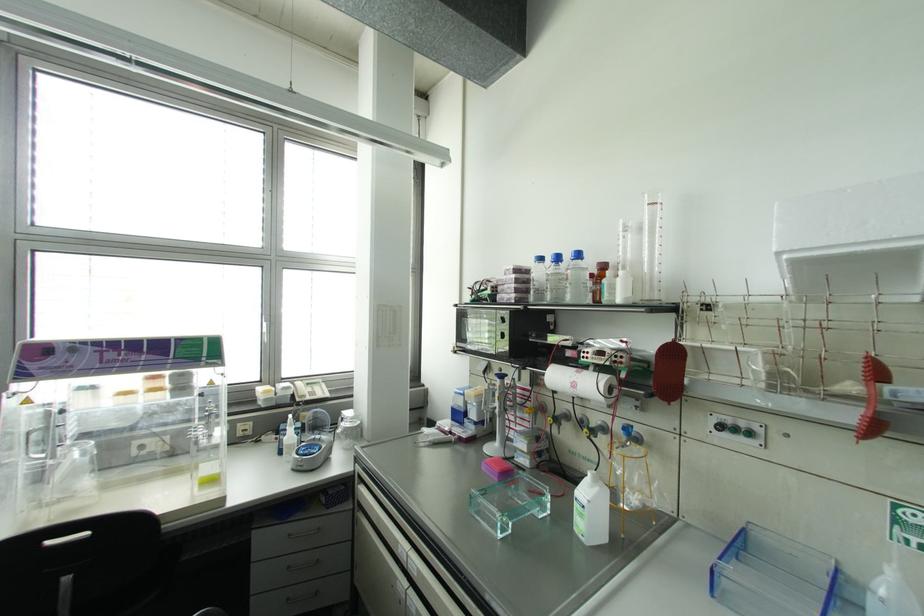
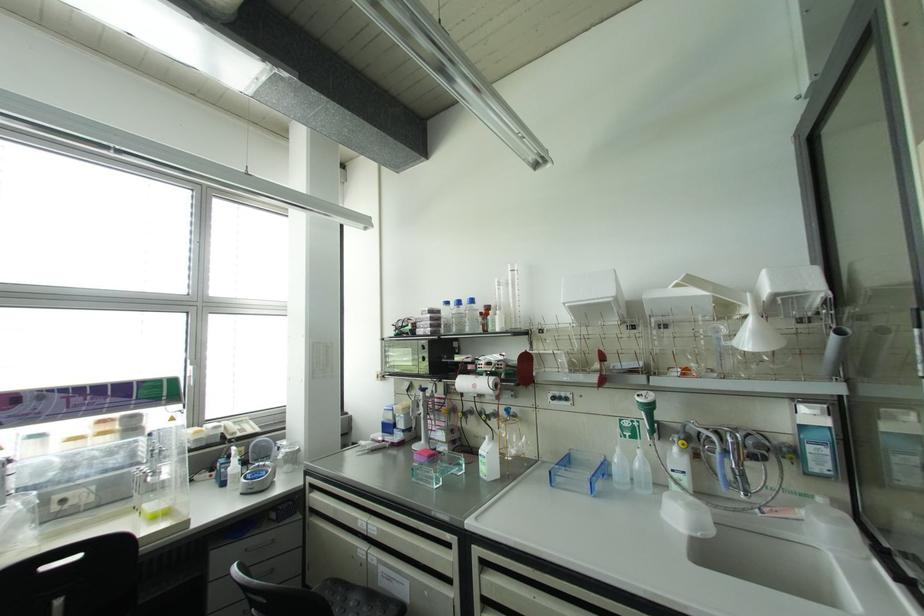
Find the pixel in the second image that matches point 540,257 in the first image.

(446, 302)